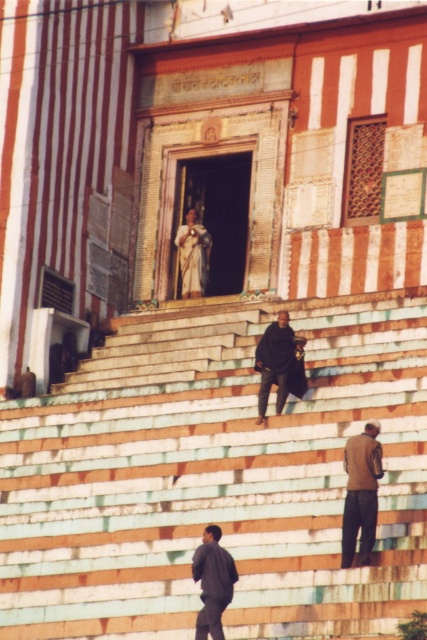
Is point (348, 397) closer to camera compared to point (196, 262)?

Yes.

Is multicolored stone steps at center shorter than white fabric statue at center?

No, multicolored stone steps at center is not shorter than white fabric statue at center.

The width and height of the screenshot is (427, 640). I want to click on multicolored stone steps at center, so click(x=216, y=480).

Does multicolored stone steps at center have a larger size compared to dark gray fabric pants at lower center?

Indeed, multicolored stone steps at center has a larger size compared to dark gray fabric pants at lower center.

Is point (70, 518) closer to camera compared to point (204, 577)?

That is False.

Where is `multicolored stone steps at center`? The image size is (427, 640). multicolored stone steps at center is located at coordinates (216, 480).

Is dark gray fabric pants at lower center positioned in front of dark matte coat at center?

That is True.

Does dark gray fabric pants at lower center have a lesser width compared to dark matte coat at center?

Incorrect, dark gray fabric pants at lower center's width is not less than dark matte coat at center's.

Does point (204, 595) come behind point (269, 364)?

No, it is in front of (269, 364).

Image resolution: width=427 pixels, height=640 pixels. Identify the location of dark gray fabric pants at lower center. (213, 582).